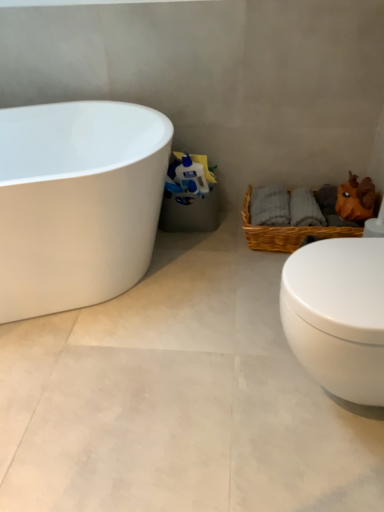
Question: From a real-world perspective, is woven brown picnic basket at lower right positioned under white glossy toilet paper at center based on gravity?

Choices:
 (A) no
 (B) yes

Answer: (B)

Question: Does woven brown picnic basket at lower right have a greater width compared to white glossy toilet paper at center?

Choices:
 (A) yes
 (B) no

Answer: (A)

Question: Would you say woven brown picnic basket at lower right contains white glossy toilet paper at center?

Choices:
 (A) yes
 (B) no

Answer: (B)

Question: Can you confirm if woven brown picnic basket at lower right is bigger than white glossy toilet paper at center?

Choices:
 (A) no
 (B) yes

Answer: (B)

Question: Is woven brown picnic basket at lower right turned away from white glossy toilet paper at center?

Choices:
 (A) yes
 (B) no

Answer: (B)

Question: Is woven brown picnic basket at lower right further to camera compared to white glossy toilet paper at center?

Choices:
 (A) no
 (B) yes

Answer: (A)

Question: Does white glossy toilet paper at center have a lesser height compared to white glossy bathtub at left?

Choices:
 (A) yes
 (B) no

Answer: (A)

Question: Is white glossy toilet paper at center looking in the opposite direction of white glossy bathtub at left?

Choices:
 (A) yes
 (B) no

Answer: (B)

Question: Is the depth of white glossy toilet paper at center less than that of white glossy bathtub at left?

Choices:
 (A) no
 (B) yes

Answer: (A)

Question: From a real-world perspective, is white glossy toilet paper at center over white glossy bathtub at left?

Choices:
 (A) no
 (B) yes

Answer: (B)

Question: Does white glossy toilet paper at center appear on the right side of white glossy bathtub at left?

Choices:
 (A) yes
 (B) no

Answer: (A)

Question: Is white glossy toilet paper at center wider than white glossy bathtub at left?

Choices:
 (A) no
 (B) yes

Answer: (A)

Question: Does white glossy bathtub at left appear on the left side of white glossy toilet paper at center?

Choices:
 (A) no
 (B) yes

Answer: (B)